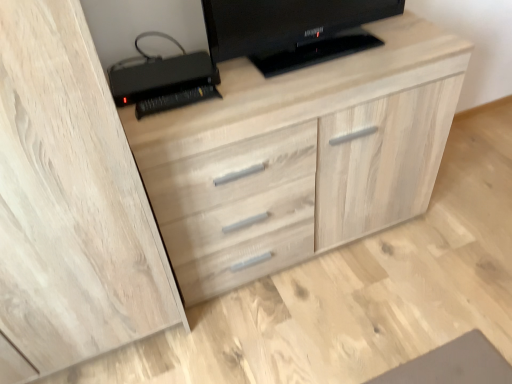
Find the location of `unoccupied region to the right of black plastic printer at upper left`. unoccupied region to the right of black plastic printer at upper left is located at coordinates (248, 85).